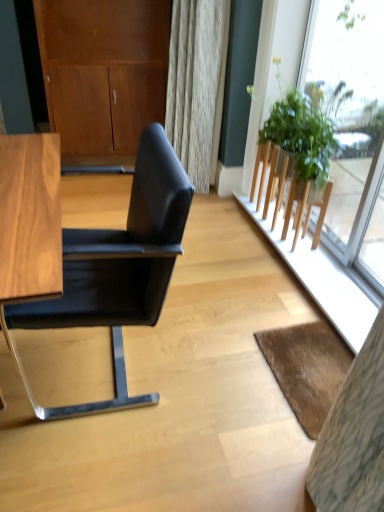
Question: Is brown textured mat at lower right not close to green leafy plant at right?

Choices:
 (A) no
 (B) yes

Answer: (A)

Question: Does brown textured mat at lower right have a larger size compared to green leafy plant at right?

Choices:
 (A) yes
 (B) no

Answer: (B)

Question: Is brown textured mat at lower right positioned with its back to green leafy plant at right?

Choices:
 (A) no
 (B) yes

Answer: (A)

Question: From the image's perspective, is brown textured mat at lower right located above green leafy plant at right?

Choices:
 (A) yes
 (B) no

Answer: (B)

Question: Is brown textured mat at lower right taller than green leafy plant at right?

Choices:
 (A) yes
 (B) no

Answer: (B)

Question: Do you think black leather chair at left is within transparent glass window at upper right, or outside of it?

Choices:
 (A) outside
 (B) inside

Answer: (A)

Question: Does point (59, 313) appear closer or farther from the camera than point (322, 82)?

Choices:
 (A) farther
 (B) closer

Answer: (B)

Question: In terms of width, does black leather chair at left look wider or thinner when compared to transparent glass window at upper right?

Choices:
 (A) wide
 (B) thin

Answer: (A)

Question: From the image's perspective, relative to transparent glass window at upper right, is black leather chair at left above or below?

Choices:
 (A) below
 (B) above

Answer: (A)

Question: In terms of size, does green leafy plant at right appear bigger or smaller than black leather chair at left?

Choices:
 (A) big
 (B) small

Answer: (B)

Question: Considering their positions, is green leafy plant at right located in front of or behind black leather chair at left?

Choices:
 (A) behind
 (B) front

Answer: (A)

Question: In terms of width, does green leafy plant at right look wider or thinner when compared to black leather chair at left?

Choices:
 (A) wide
 (B) thin

Answer: (B)

Question: Considering the positions of green leafy plant at right and black leather chair at left in the image, is green leafy plant at right taller or shorter than black leather chair at left?

Choices:
 (A) short
 (B) tall

Answer: (A)

Question: Is matte wood dresser at upper left bigger or smaller than transparent glass window at upper right?

Choices:
 (A) big
 (B) small

Answer: (A)

Question: Is matte wood dresser at upper left situated inside transparent glass window at upper right or outside?

Choices:
 (A) inside
 (B) outside

Answer: (B)